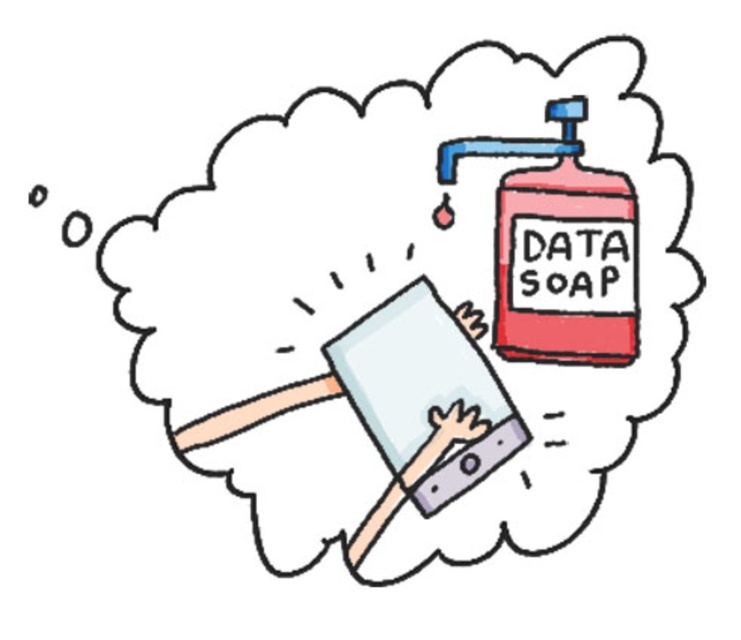
Does matte red plastic data soap at upper right have a greater width compared to smooth skin hand at center?

Correct, the width of matte red plastic data soap at upper right exceeds that of smooth skin hand at center.

Find the location of a particular element. matte red plastic data soap at upper right is located at coordinates (559, 248).

Which of these two, matte red plastic data soap at upper right or white matte hand at center, stands shorter?

white matte hand at center

Which is more to the right, matte red plastic data soap at upper right or white matte hand at center?

From the viewer's perspective, matte red plastic data soap at upper right appears more on the right side.

Which is in front, point (548, 298) or point (471, 419)?

Point (548, 298) is in front.

Locate an element on the screen. The width and height of the screenshot is (741, 640). matte red plastic data soap at upper right is located at coordinates (559, 248).

Is white matte hand at center to the left of matte gray hand at center from the viewer's perspective?

Correct, you'll find white matte hand at center to the left of matte gray hand at center.

Measure the distance between white matte hand at center and matte gray hand at center.

white matte hand at center and matte gray hand at center are 1.15 inches apart from each other.

Between point (471, 410) and point (468, 300), which one is positioned behind?

The point (468, 300) is behind.

You are a GUI agent. You are given a task and a screenshot of the screen. Output one action in this format:
    pyautogui.click(x=<x>, y=<y>)
    Task: Click on the white matte hand at center
    The image size is (741, 640).
    Given the screenshot: What is the action you would take?
    pyautogui.click(x=442, y=440)